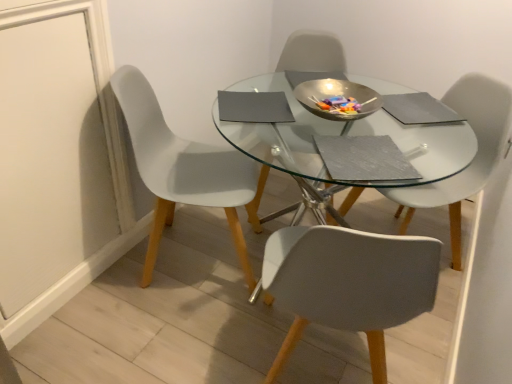
Question: In terms of height, does white plastic chair at center, the 3th chair when ordered from left to right, look taller or shorter compared to white plastic chair at left, the third chair positioned from the right?

Choices:
 (A) short
 (B) tall

Answer: (A)

Question: From the image's perspective, is white plastic chair at center, which is counted as the 1th chair, starting from the right, located above or below white plastic chair at left, which ranks as the 1th chair in left-to-right order?

Choices:
 (A) below
 (B) above

Answer: (B)

Question: Which object is the closest to the transparent glass table at center?

Choices:
 (A) white plastic chair at left, which ranks as the 1th chair in left-to-right order
 (B) white plastic chair at center, which is counted as the 1th chair, starting from the right
 (C) matte gray chair at center, which ranks as the second chair in left-to-right order

Answer: (C)

Question: Which object is positioned closest to the transparent glass table at center?

Choices:
 (A) matte gray chair at center, which ranks as the second chair in left-to-right order
 (B) white plastic chair at center, the 3th chair when ordered from left to right
 (C) white plastic chair at left, the third chair positioned from the right

Answer: (A)